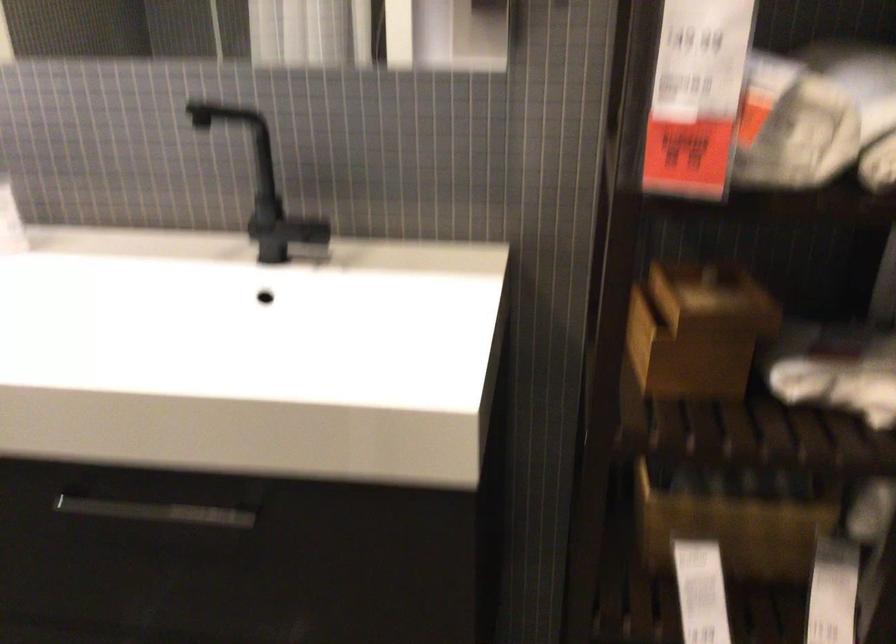
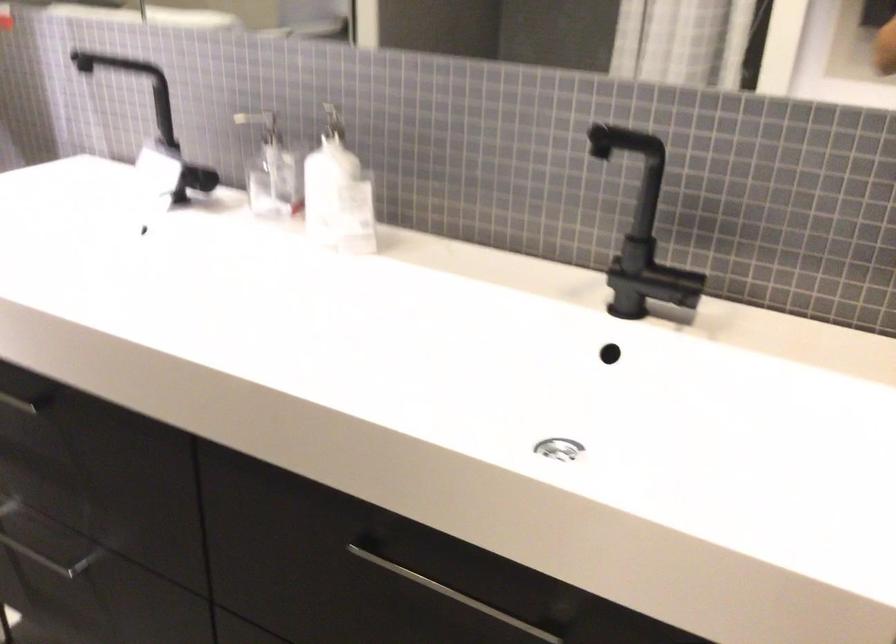
Question: The camera is either moving clockwise (left) or counter-clockwise (right) around the object. The first image is from the beginning of the video and the second image is from the end. Is the camera moving left or right when shooting the video?

Choices:
 (A) Left
 (B) Right

Answer: (B)